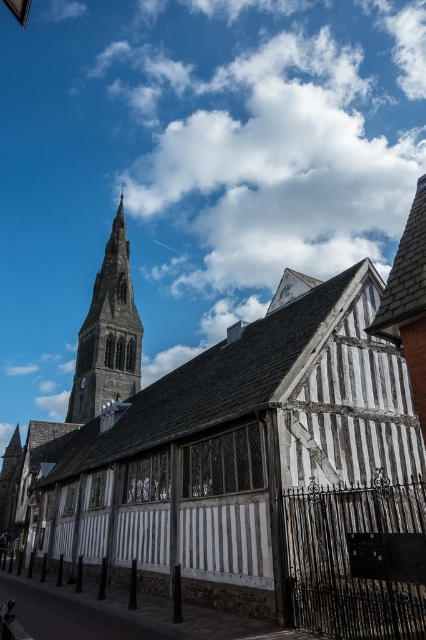
Is point (293, 401) positioned before point (95, 362)?

Yes, it is.

Is white timber-framed building at center to the left of dark gray stone tower at upper left from the viewer's perspective?

A: In fact, white timber-framed building at center is to the right of dark gray stone tower at upper left.

What do you see at coordinates (216, 435) in the screenshot?
I see `white timber-framed building at center` at bounding box center [216, 435].

Image resolution: width=426 pixels, height=640 pixels. What are the coordinates of `white timber-framed building at center` in the screenshot? It's located at (216, 435).